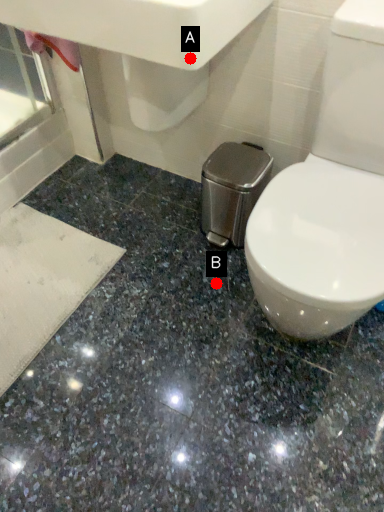
Question: Two points are circled on the image, labeled by A and B beside each circle. Which of the following is the farthest from the observer?

Choices:
 (A) A is further
 (B) B is further

Answer: (B)